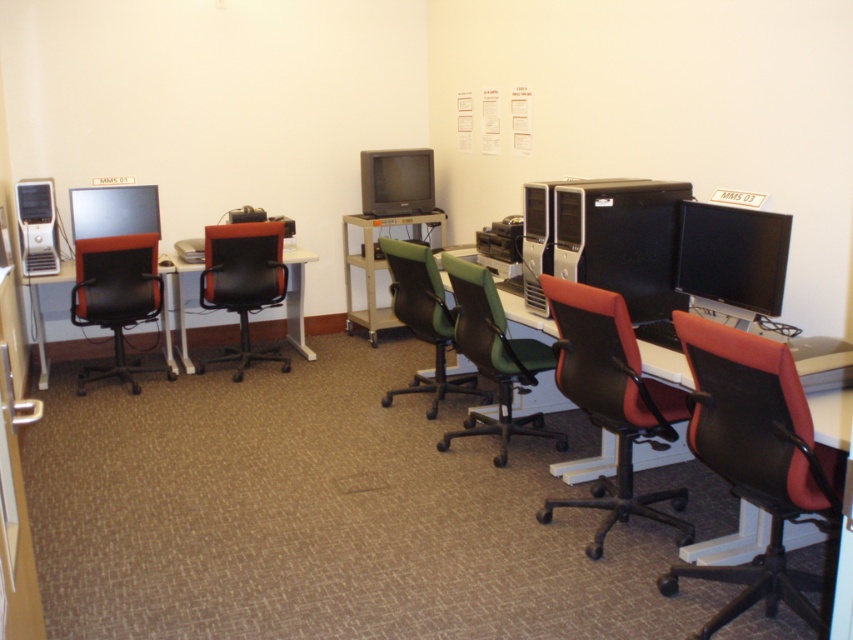
What do you see at coordinates (242, 284) in the screenshot? I see `black leather office chair at center` at bounding box center [242, 284].

Is black leather office chair at center closer to the viewer compared to matte black tower at left?

No, black leather office chair at center is behind matte black tower at left.

Measure the distance between point (225, 268) and camera.

Point (225, 268) and camera are 16.51 feet apart.

At what (x,y) coordinates should I click in order to perform the action: click on black leather office chair at center. Please return your answer as a coordinate pair (x, y). Image resolution: width=853 pixels, height=640 pixels. Looking at the image, I should click on (242, 284).

Can you confirm if white plastic table at left is thinner than metallic silver table at center?

Yes.

Does point (289, 259) come in front of point (415, 225)?

Yes, it is in front of point (415, 225).

The height and width of the screenshot is (640, 853). I want to click on white plastic table at left, so [x=173, y=314].

Is black leather swivel chair at right smaller than matte gray monitor at center?

Actually, black leather swivel chair at right might be larger than matte gray monitor at center.

Who is positioned more to the left, black leather swivel chair at right or matte gray monitor at center?

From the viewer's perspective, matte gray monitor at center appears more on the left side.

Between point (700, 420) and point (376, 212), which one is positioned in front?

Point (700, 420)

Locate an element on the screen. black leather swivel chair at right is located at coordinates (753, 461).